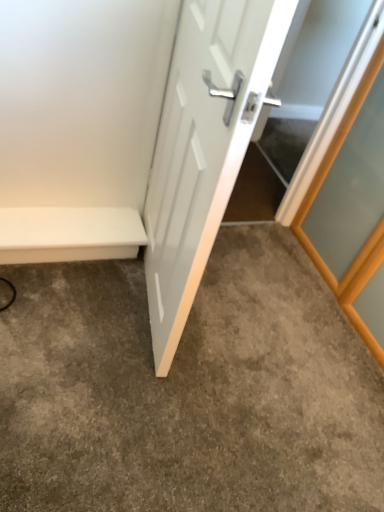
In order to click on empty space that is ontop of white matte bench at lower left (from a real-world perspective) in this screenshot , I will do `click(77, 220)`.